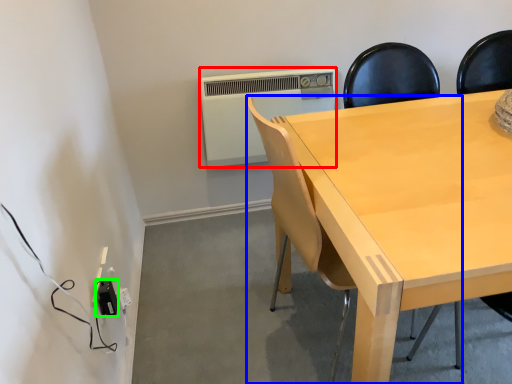
Question: Which object is positioned closest to air conditioning (highlighted by a red box)? Select from chair (highlighted by a blue box) and electric outlet (highlighted by a green box).

Choices:
 (A) chair
 (B) electric outlet

Answer: (A)